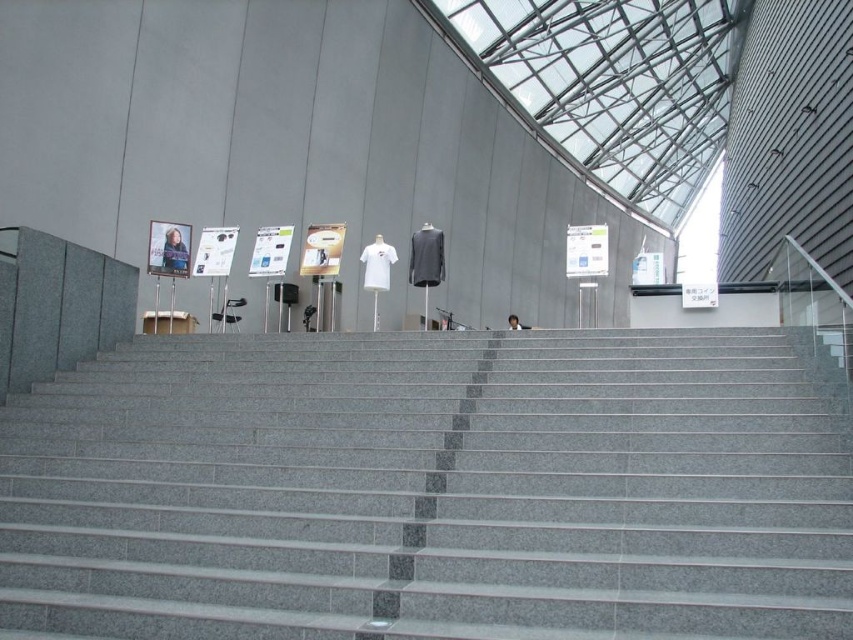
Measure the distance between point [386,276] and camera.

They are 39.16 feet apart.

Is white matte t-shirt at center above light brown hair at center?

Yes.

Does point (369, 275) lie behind point (517, 317)?

No, it is not.

The height and width of the screenshot is (640, 853). What are the coordinates of `white matte t-shirt at center` in the screenshot? It's located at (376, 264).

Based on the photo, is gray granite stairs at center taller than light brown hair at center?

Incorrect, gray granite stairs at center's height is not larger of light brown hair at center's.

Is gray granite stairs at center above light brown hair at center?

No, gray granite stairs at center is not above light brown hair at center.

Between point (782, 499) and point (514, 316), which one is positioned in front?

Point (782, 499)

The image size is (853, 640). Find the location of `gray granite stairs at center`. gray granite stairs at center is located at coordinates coord(428,492).

Can you confirm if gray granite stairs at center is thinner than white matte t-shirt at center?

Yes, gray granite stairs at center is thinner than white matte t-shirt at center.

Is gray granite stairs at center bigger than white matte t-shirt at center?

Actually, gray granite stairs at center might be smaller than white matte t-shirt at center.

Does point (283, 528) come farther from viewer compared to point (381, 269)?

No.

Identify the location of gray granite stairs at center. The width and height of the screenshot is (853, 640). (428, 492).